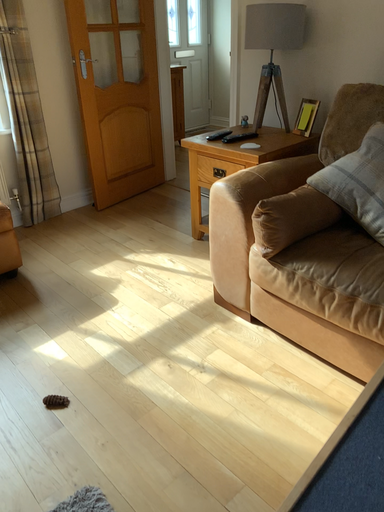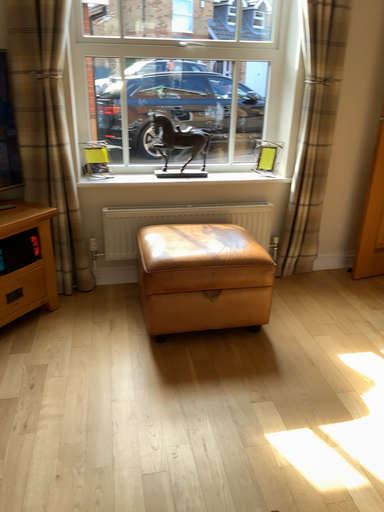
Question: Which way did the camera rotate in the video?

Choices:
 (A) rotated downward
 (B) rotated upward

Answer: (B)